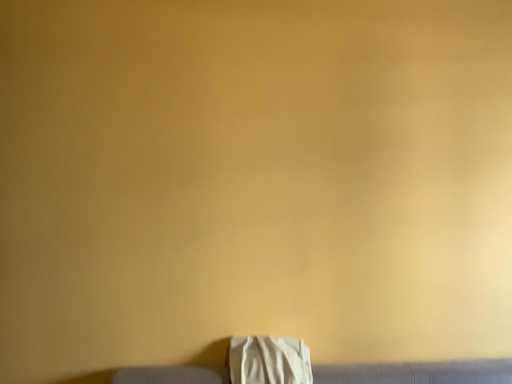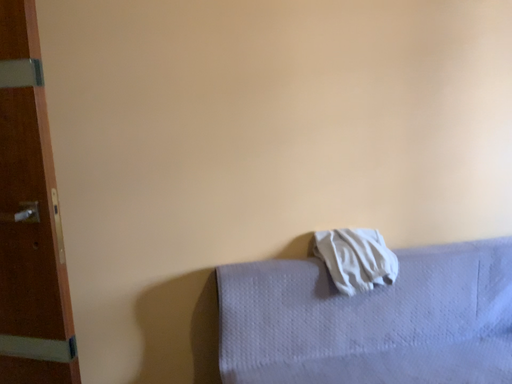
Question: How did the camera likely rotate when shooting the video?

Choices:
 (A) rotated downward
 (B) rotated upward

Answer: (A)